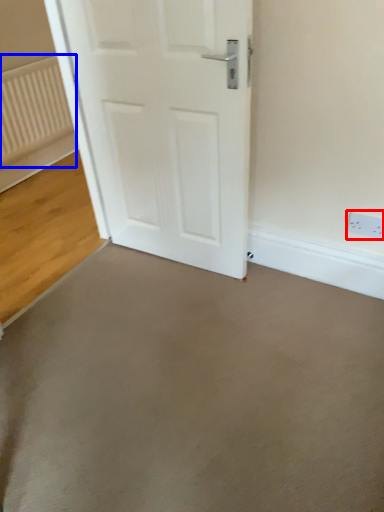
Question: Which object is closer to the camera taking this photo, electric outlet (highlighted by a red box) or radiator (highlighted by a blue box)?

Choices:
 (A) electric outlet
 (B) radiator

Answer: (A)